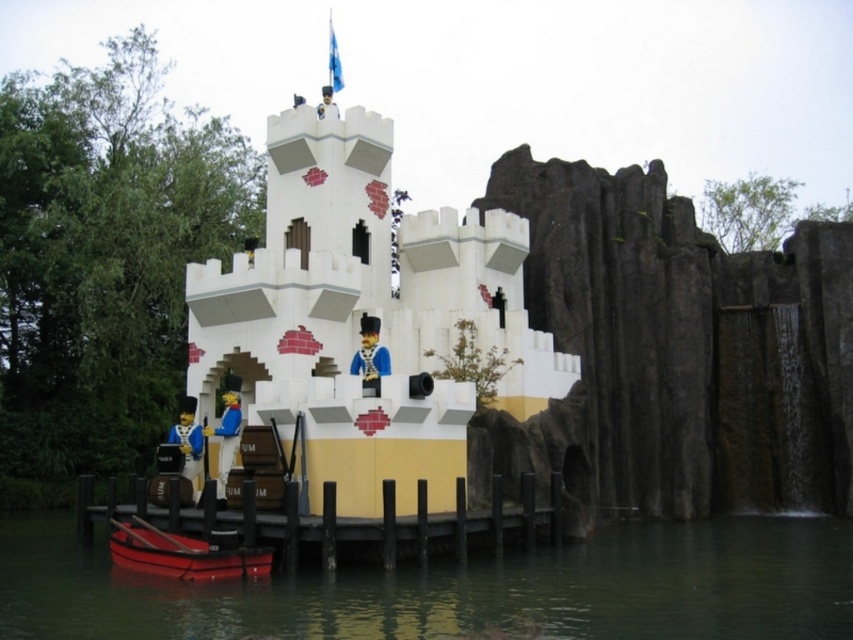
Question: Considering the relative positions of smooth wood dock at lower center and shiny red boat at lower left in the image provided, where is smooth wood dock at lower center located with respect to shiny red boat at lower left?

Choices:
 (A) left
 (B) right

Answer: (B)

Question: Does white plastic castle at center have a larger size compared to green matte water at lower center?

Choices:
 (A) no
 (B) yes

Answer: (B)

Question: Which point is closer to the camera?

Choices:
 (A) (254, 529)
 (B) (674, 609)
 (C) (149, 548)
 (D) (412, 227)

Answer: (B)

Question: Estimate the real-world distances between objects in this image. Which object is closer to the shiny red boat at lower left?

Choices:
 (A) smooth wood dock at lower center
 (B) white plastic castle at center

Answer: (A)

Question: Which of the following is the farthest from the observer?

Choices:
 (A) shiny red boat at lower left
 (B) green matte water at lower center
 (C) white plastic castle at center
 (D) smooth wood dock at lower center

Answer: (C)

Question: Can you confirm if white plastic castle at center is positioned above green matte water at lower center?

Choices:
 (A) no
 (B) yes

Answer: (B)